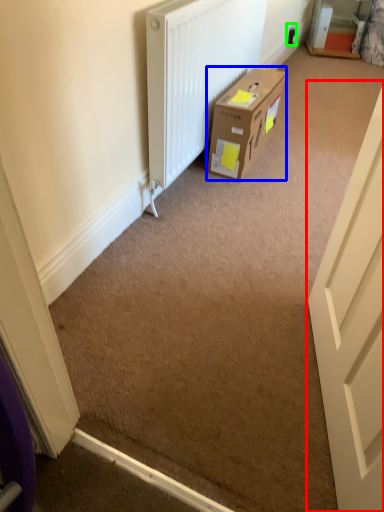
Question: Based on their relative distances, which object is nearer to door (highlighted by a red box)? Choose from box (highlighted by a blue box) and electric outlet (highlighted by a green box).

Choices:
 (A) box
 (B) electric outlet

Answer: (A)